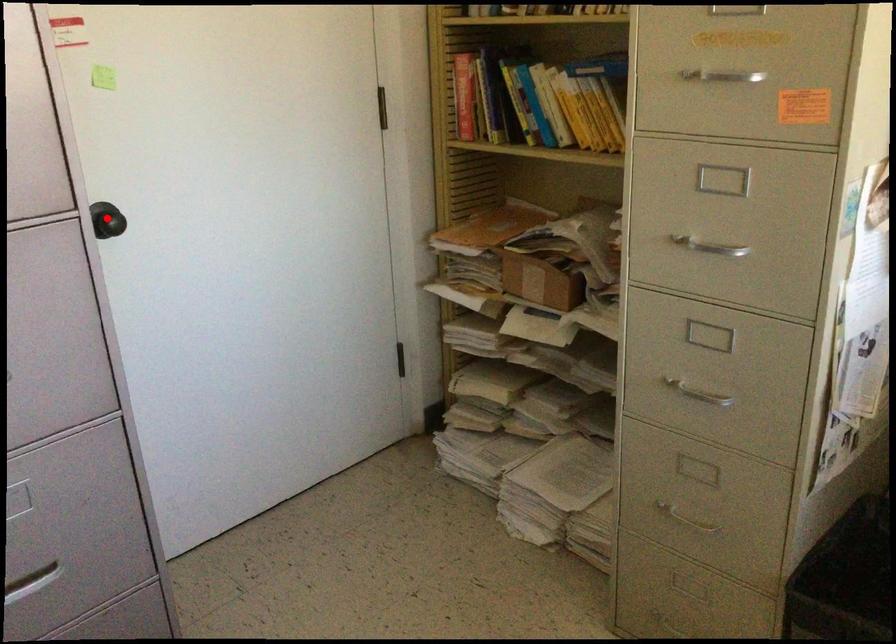
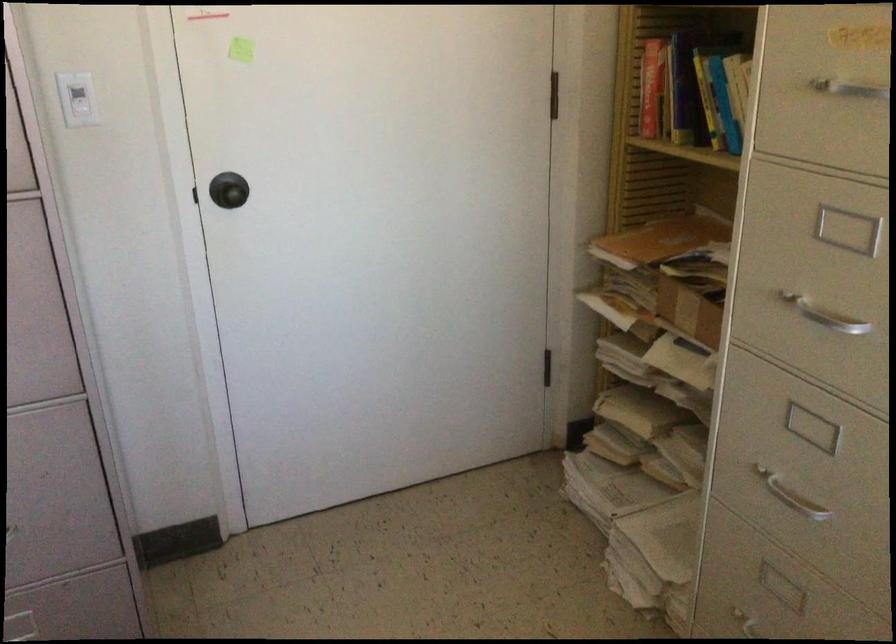
The point at the highlighted location is marked in the first image. Where is the corresponding point in the second image?

(228, 190)